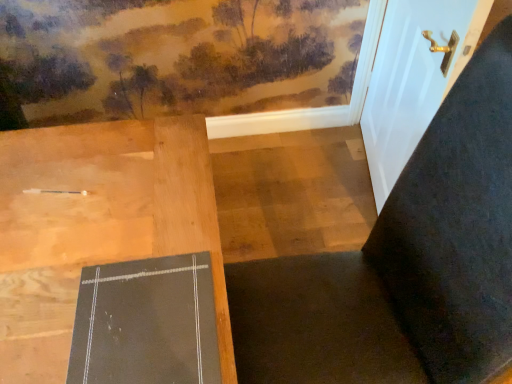
Question: Is white glossy door at upper right facing towards matte black bulletin board at center?

Choices:
 (A) yes
 (B) no

Answer: (B)

Question: From the image's perspective, is white glossy door at upper right above matte black bulletin board at center?

Choices:
 (A) no
 (B) yes

Answer: (B)

Question: Considering the relative sizes of white glossy door at upper right and matte black bulletin board at center in the image provided, is white glossy door at upper right wider than matte black bulletin board at center?

Choices:
 (A) no
 (B) yes

Answer: (A)

Question: Is white glossy door at upper right thinner than matte black bulletin board at center?

Choices:
 (A) yes
 (B) no

Answer: (A)

Question: Can you confirm if white glossy door at upper right is positioned to the left of matte black bulletin board at center?

Choices:
 (A) no
 (B) yes

Answer: (A)

Question: Is point (385, 79) closer or farther from the camera than point (362, 306)?

Choices:
 (A) closer
 (B) farther

Answer: (B)

Question: In terms of width, does white glossy door at upper right look wider or thinner when compared to dark fabric chair at center?

Choices:
 (A) thin
 (B) wide

Answer: (A)

Question: Considering the positions of white glossy door at upper right and dark fabric chair at center in the image, is white glossy door at upper right taller or shorter than dark fabric chair at center?

Choices:
 (A) tall
 (B) short

Answer: (B)

Question: From a real-world perspective, is white glossy door at upper right positioned above or below dark fabric chair at center?

Choices:
 (A) above
 (B) below

Answer: (A)

Question: Looking at their shapes, would you say white glossy door at upper right is wider or thinner than matte black bulletin board at center?

Choices:
 (A) thin
 (B) wide

Answer: (A)

Question: In terms of height, does white glossy door at upper right look taller or shorter compared to matte black bulletin board at center?

Choices:
 (A) short
 (B) tall

Answer: (B)

Question: In the image, is white glossy door at upper right positioned in front of or behind matte black bulletin board at center?

Choices:
 (A) front
 (B) behind

Answer: (B)

Question: Does point (399, 3) appear closer or farther from the camera than point (157, 345)?

Choices:
 (A) closer
 (B) farther

Answer: (B)

Question: Looking at their shapes, would you say dark fabric chair at center is wider or thinner than white glossy door at upper right?

Choices:
 (A) wide
 (B) thin

Answer: (A)

Question: From a real-world perspective, is dark fabric chair at center positioned above or below white glossy door at upper right?

Choices:
 (A) above
 (B) below

Answer: (B)